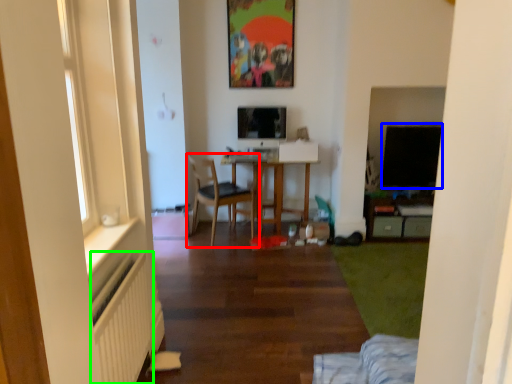
Question: Which object is positioned farthest from chair (highlighted by a red box)? Select from window screen (highlighted by a blue box) and radiator (highlighted by a green box).

Choices:
 (A) window screen
 (B) radiator

Answer: (B)